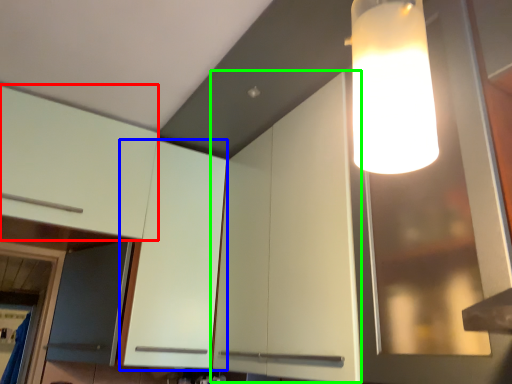
Question: Which is nearer to the cabinetry (highlighted by a red box)? cabinetry (highlighted by a blue box) or cabinetry (highlighted by a green box).

Choices:
 (A) cabinetry
 (B) cabinetry

Answer: (A)